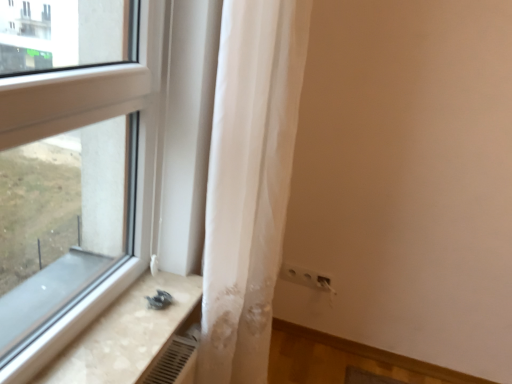
Question: Choose the correct answer: Is beige marble counter top at lower left inside white plastic electric outlet at lower right or outside it?

Choices:
 (A) outside
 (B) inside

Answer: (A)

Question: Considering the positions of beige marble counter top at lower left and white plastic electric outlet at lower right in the image, is beige marble counter top at lower left taller or shorter than white plastic electric outlet at lower right?

Choices:
 (A) short
 (B) tall

Answer: (A)

Question: Which object is positioned farthest from the white plastic electric outlet at lower right?

Choices:
 (A) white sheer curtain at center
 (B) beige marble counter top at lower left

Answer: (B)

Question: Which is nearer to the white sheer curtain at center?

Choices:
 (A) beige marble counter top at lower left
 (B) white plastic electric outlet at lower right

Answer: (A)